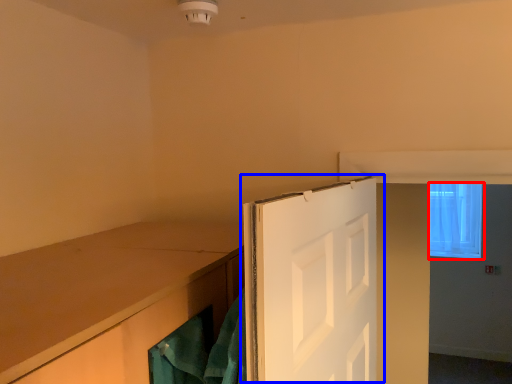
Question: Among these objects, which one is farthest to the camera, window (highlighted by a red box) or door (highlighted by a blue box)?

Choices:
 (A) window
 (B) door

Answer: (A)